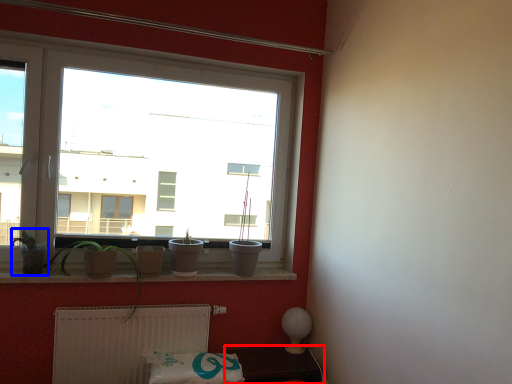
Question: Among these objects, which one is nearest to the camera, furniture (highlighted by a red box) or plant (highlighted by a blue box)?

Choices:
 (A) furniture
 (B) plant

Answer: (B)